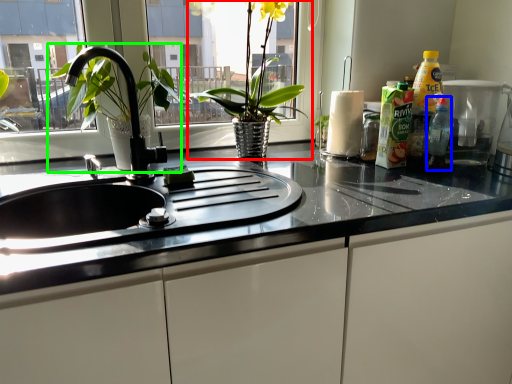
Question: Which object is the closest to the houseplant (highlighted by a red box)? Choose among these: bottle (highlighted by a blue box) or tap (highlighted by a green box).

Choices:
 (A) bottle
 (B) tap

Answer: (B)